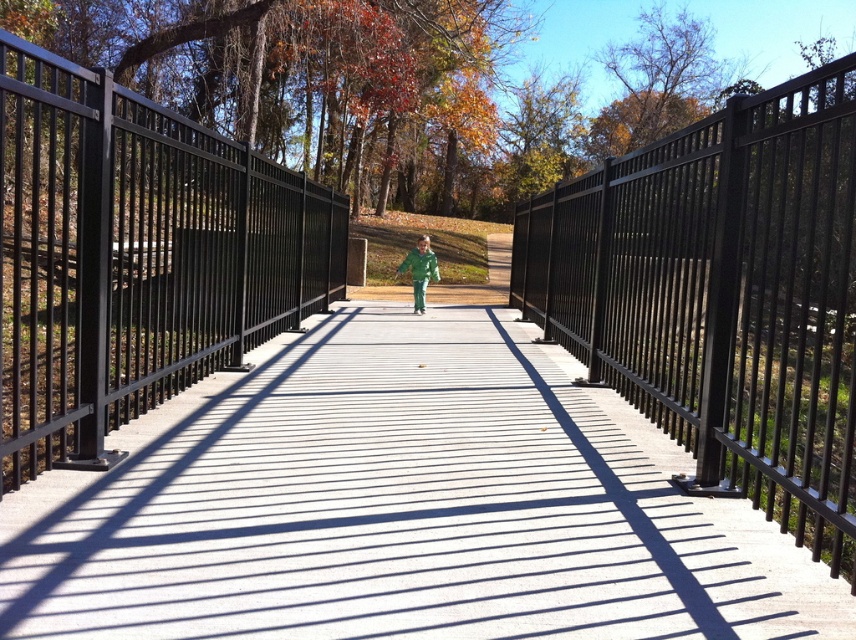
Question: Among these points, which one is farthest from the camera?

Choices:
 (A) (762, 115)
 (B) (247, 163)
 (C) (557, 605)

Answer: (B)

Question: Does black metal fence at left have a greater width compared to green matte jacket at center?

Choices:
 (A) yes
 (B) no

Answer: (A)

Question: Can you confirm if black metal fence at left is positioned above green matte jacket at center?

Choices:
 (A) no
 (B) yes

Answer: (B)

Question: Does smooth concrete path at center lie in front of black metal fence at center?

Choices:
 (A) no
 (B) yes

Answer: (A)

Question: Which object is positioned farthest from the green matte jacket at center?

Choices:
 (A) black metal fence at left
 (B) smooth concrete path at center

Answer: (B)

Question: Which point is closer to the camera taking this photo?

Choices:
 (A) (34, 138)
 (B) (415, 300)

Answer: (A)